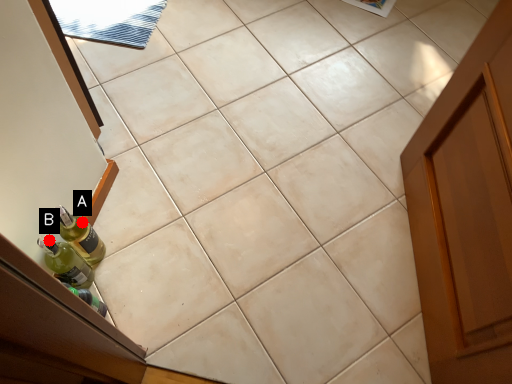
Question: Two points are circled on the image, labeled by A and B beside each circle. Among these points, which one is farthest from the camera?

Choices:
 (A) A is further
 (B) B is further

Answer: (A)